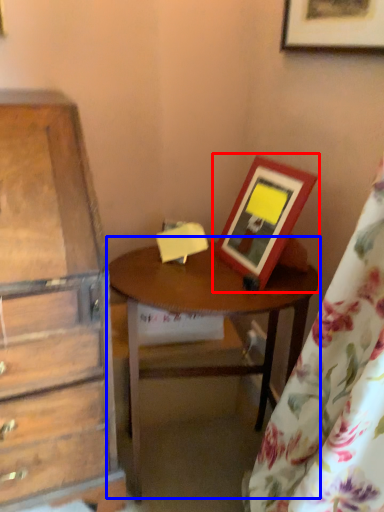
Question: Which of the following is the closest to the observer, picture frame (highlighted by a red box) or table (highlighted by a blue box)?

Choices:
 (A) picture frame
 (B) table

Answer: (A)